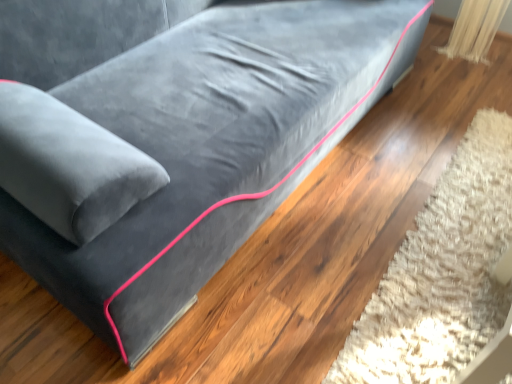
This screenshot has height=384, width=512. I want to click on beige textured rug at lower right, so click(442, 273).

Measure the distance between beige textured rug at lower right and camera.

The depth of beige textured rug at lower right is 1.14 meters.

Describe the element at coordinates (442, 273) in the screenshot. I see `beige textured rug at lower right` at that location.

Identify the location of beige textured rug at lower right. (442, 273).